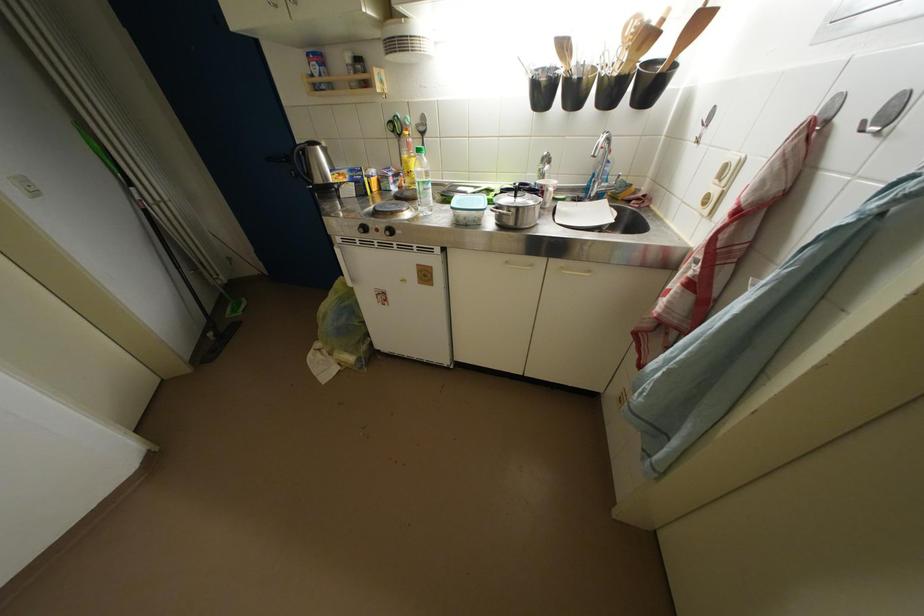
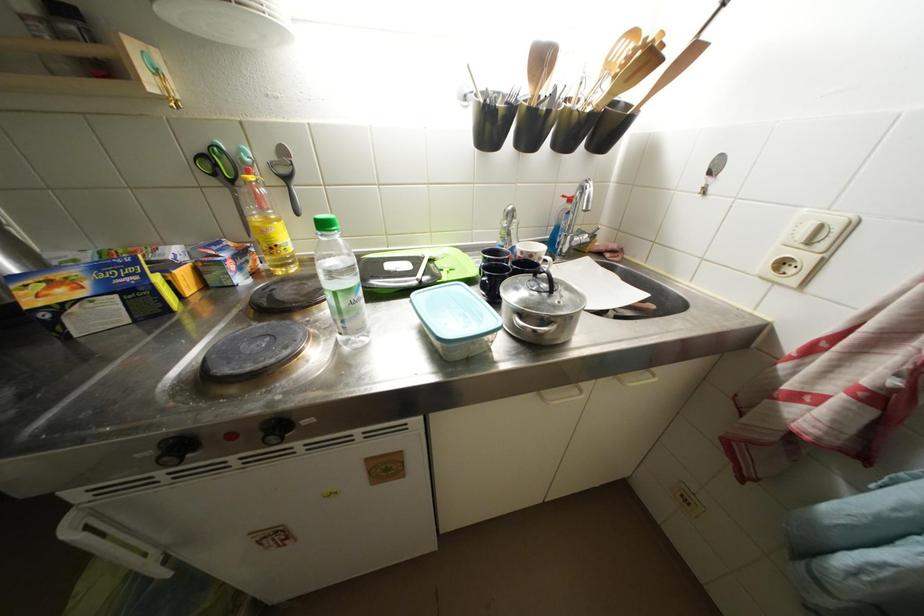
Question: Based on the continuous images, in which direction is the camera rotating? Reply with the corresponding letter.

Choices:
 (A) Left
 (B) Right
 (C) Up
 (D) Down

Answer: (B)